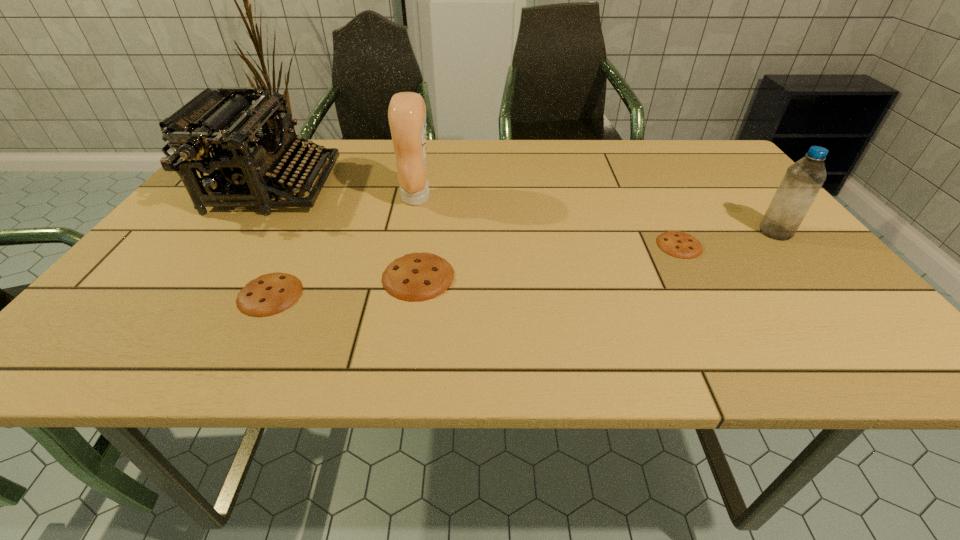
At what (x,y) coordinates should I click in order to perform the action: click on vacant space that satisfies the following two spatial constraints: 1. on the label of the rightmost object; 2. on the left side of the condiment. Please return your answer as a coordinate pair (x, y). Looking at the image, I should click on (410, 232).

At what (x,y) coordinates should I click in order to perform the action: click on vacant area that satisfies the following two spatial constraints: 1. on the back side of the fifth object from left to right; 2. on the typing side of the typewriter. Please return your answer as a coordinate pair (x, y). The width and height of the screenshot is (960, 540). Looking at the image, I should click on (647, 187).

Where is `vacant region that satisfies the following two spatial constraints: 1. on the typing side of the typewriter; 2. on the left side of the water bottle`? This screenshot has height=540, width=960. vacant region that satisfies the following two spatial constraints: 1. on the typing side of the typewriter; 2. on the left side of the water bottle is located at coordinates tap(244, 232).

I want to click on free point that satisfies the following two spatial constraints: 1. on the back side of the water bottle; 2. on the right side of the second cookie from right to left, so click(425, 232).

You are a GUI agent. You are given a task and a screenshot of the screen. Output one action in this format:
    pyautogui.click(x=<x>, y=<y>)
    Task: Click on the vacant position in the image that satisfies the following two spatial constraints: 1. on the typing side of the typewriter; 2. on the right side of the tallest cookie
    The width and height of the screenshot is (960, 540).
    Given the screenshot: What is the action you would take?
    pyautogui.click(x=214, y=276)

What are the coordinates of `vacant space that satisfies the following two spatial constraints: 1. on the label of the condiment; 2. on the back side of the second object from right to left` in the screenshot? It's located at (407, 245).